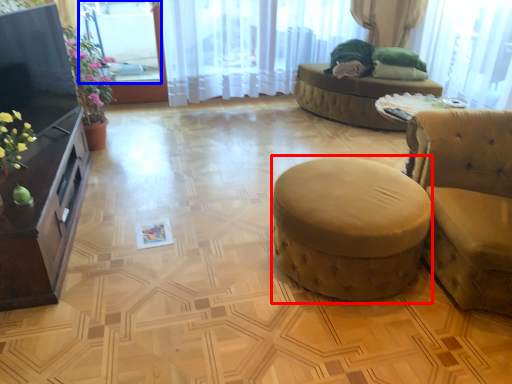
Question: Which point is further to the camera, stool (highlighted by a red box) or window screen (highlighted by a blue box)?

Choices:
 (A) stool
 (B) window screen

Answer: (B)